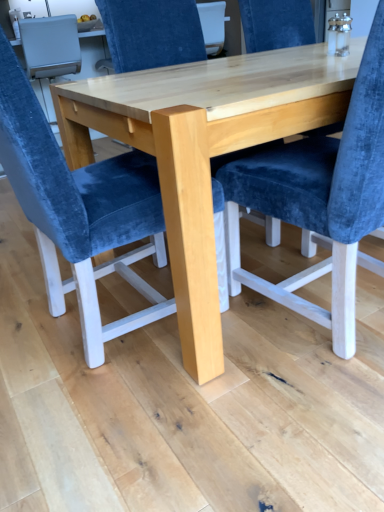
Find the location of a particular element. free space below velvet blue chair at center, placed as the first chair when sorted from front to back (from a real-world perspective) is located at coordinates (78, 335).